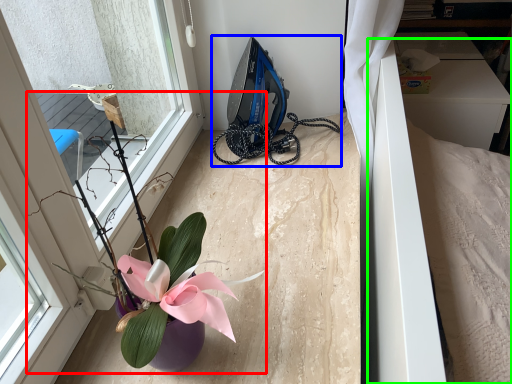
Question: Based on their relative distances, which object is nearer to houseplant (highlighted by a red box)? Choose from equipment (highlighted by a blue box) and bed (highlighted by a green box).

Choices:
 (A) equipment
 (B) bed

Answer: (B)